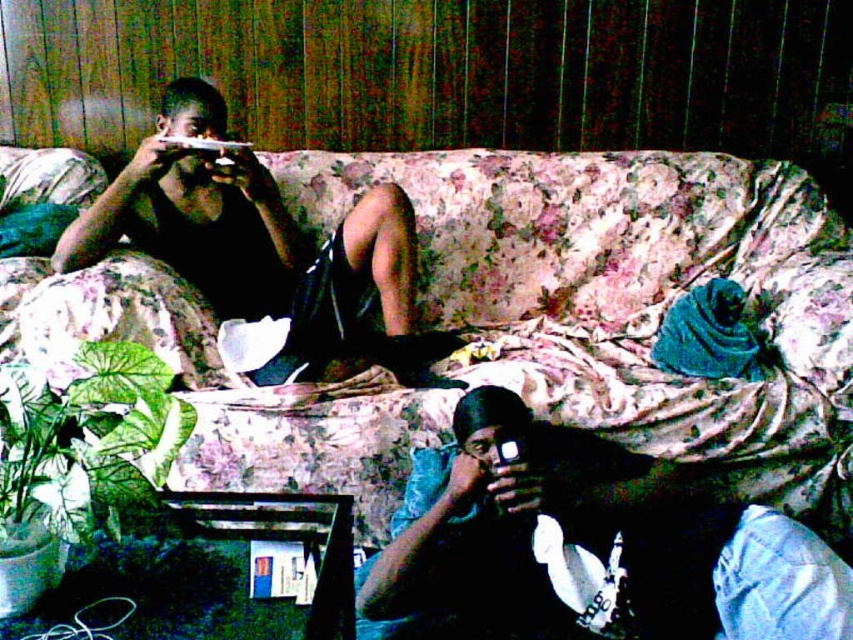
You are trying to locate your matte black phone at center in the scene. According to the coordinates provided, where exactly is it positioned?

The matte black phone at center is located at point coordinates of (584, 547).

You are standing in the room and want to place a small plant between the two points, point (476, 524) and point (135, 230). Which point should the plant be closer to so it is positioned in front of the other point?

The plant should be placed closer to point (476, 524) because it is in front of point (135, 230).